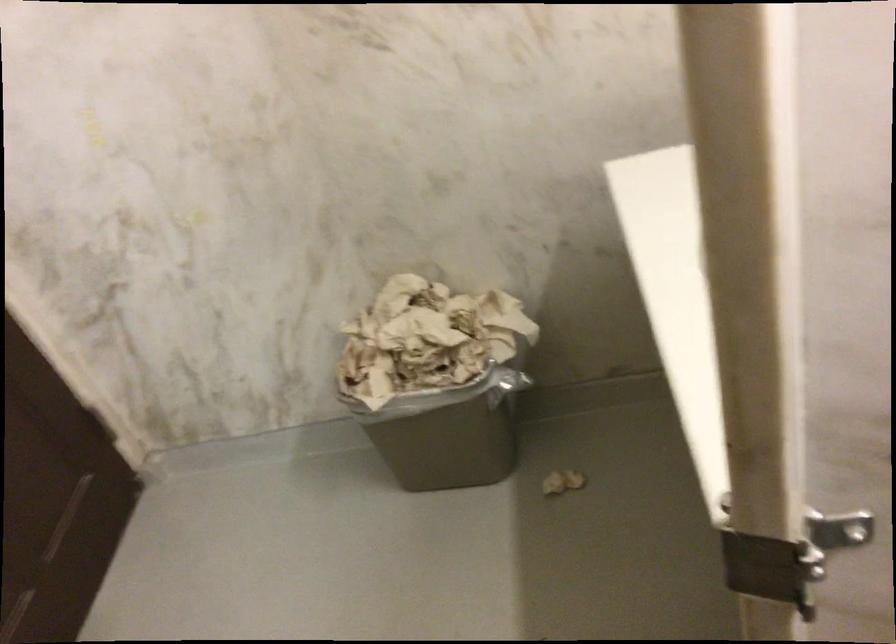
Describe the element at coordinates (771, 569) in the screenshot. The height and width of the screenshot is (644, 896). I see `a stall door latch` at that location.